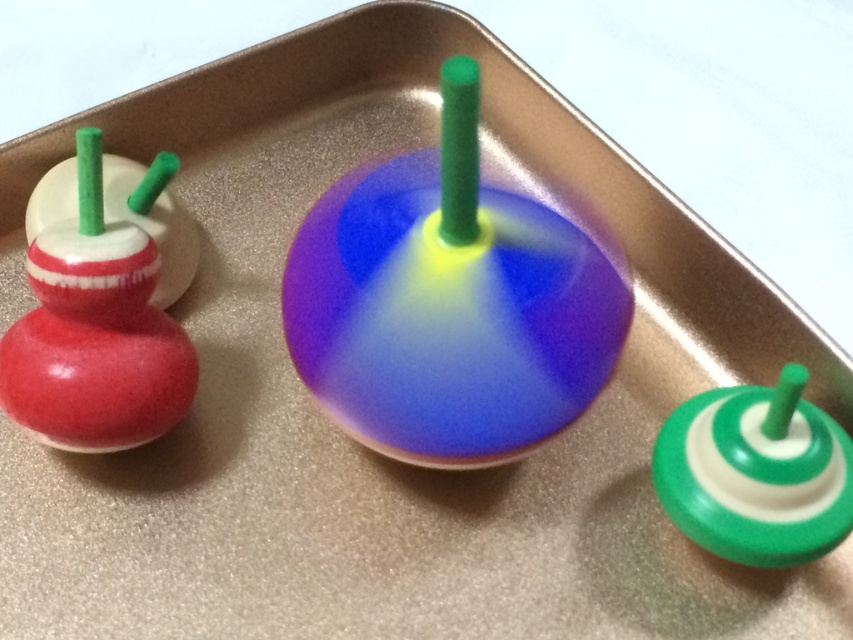
You are trying to decide which top to spin first. The shiny plastic spinning top at center is larger than the matte red wooden toy at left. Which one would you choose if you want the bigger one?

The shiny plastic spinning top at center is bigger than the matte red wooden toy at left, so you should choose the shiny plastic spinning top at center if you want the bigger one.

You are a child trying to reach the shiny plastic spinning top at center and the matte red wooden toy at left on the tray. Which one is closer to you?

The shiny plastic spinning top at center is located above the matte red wooden toy at left, so it is closer to you.